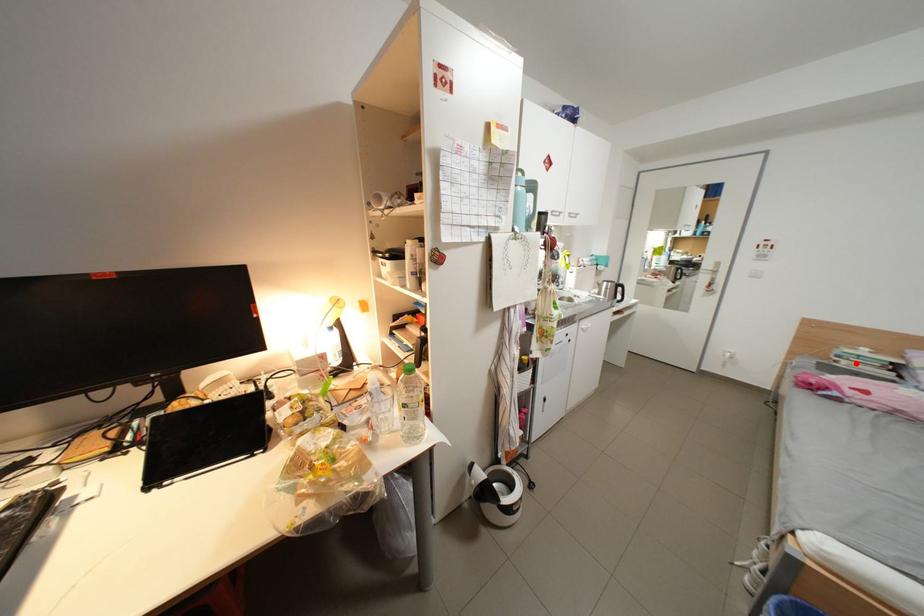
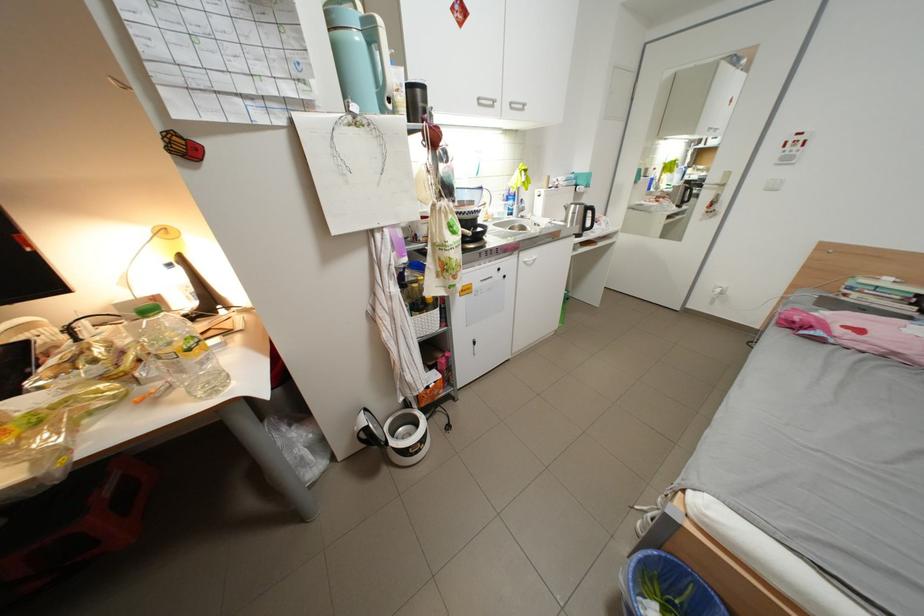
Locate, in the second image, the point that corresponds to the highlighted location in the first image.

(867, 296)